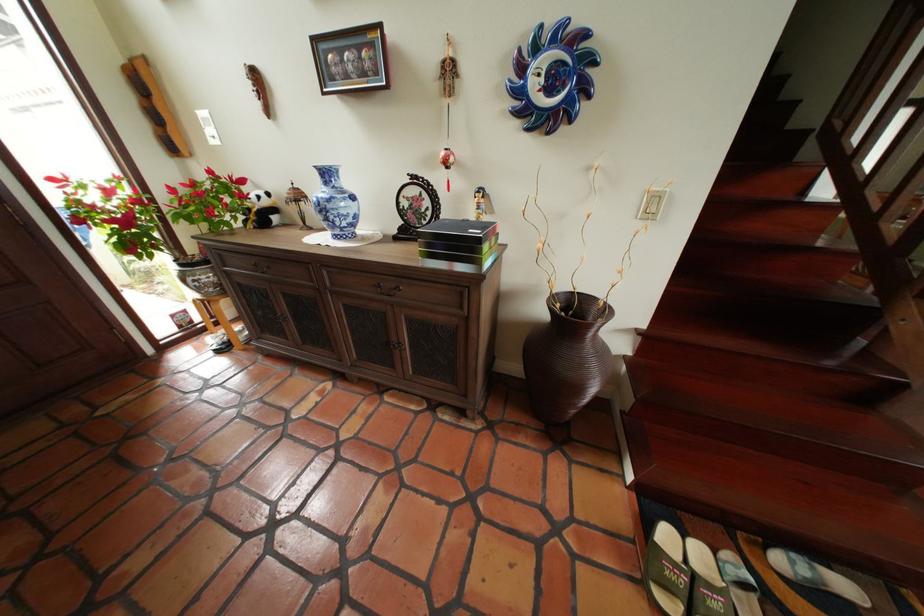
Where is `round decorative frame`? The image size is (924, 616). round decorative frame is located at coordinates (552, 76).